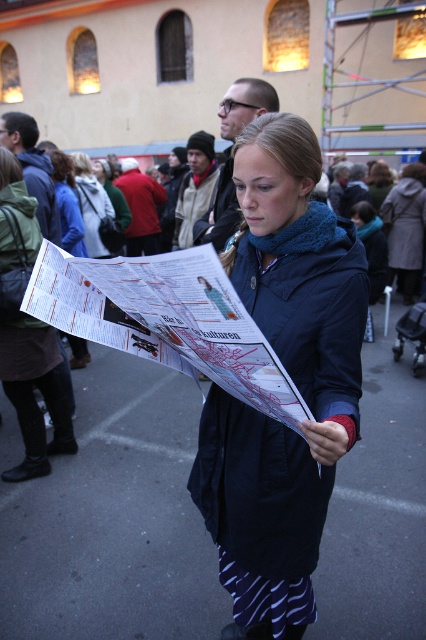
Question: Among these points, which one is nearest to the camera?

Choices:
 (A) (80, 209)
 (B) (270, 620)

Answer: (B)

Question: Where is white printed map at center located in relation to matte paper map at center in the image?

Choices:
 (A) above
 (B) below

Answer: (B)

Question: Does blue matte coat at center appear under white printed map at center?

Choices:
 (A) yes
 (B) no

Answer: (A)

Question: Which point is farther from the camera taking this photo?

Choices:
 (A) (126, 342)
 (B) (80, 356)
 (C) (276, 316)

Answer: (B)

Question: Is blue matte coat at center above white printed map at center?

Choices:
 (A) yes
 (B) no

Answer: (B)

Question: Which of the following is the closest to the observer?

Choices:
 (A) white printed map at center
 (B) blue matte coat at center

Answer: (A)